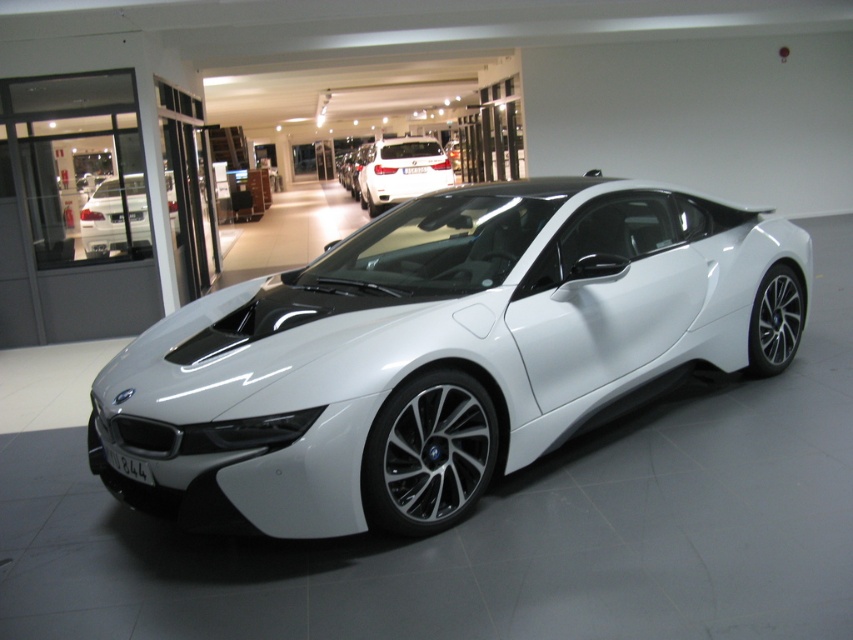
You are a car enthusiast visiting a showroom and see two cars at the center. The white glossy sedan at center and the white matte car at center. Which one is taller?

The white glossy sedan at center is taller than the white matte car at center.

You are standing in the BMW showroom and want to take a photo of the car. You notice two points on the car, point 1 at coordinates point (97,220) and point 2 at coordinates point (416,195). Which point will appear closer to you in the photo?

Point (97,220) is closer to the viewer than point (416,195), so it will appear closer in the photo.

You are standing in the BMW showroom and want to take a photo of the BMW i8 sports car. You notice two points on the car, one at point (x=387, y=436) and the other at point (x=404, y=193). Which point is closer to you?

Point (x=387, y=436) is closer to the viewer than point (x=404, y=193).